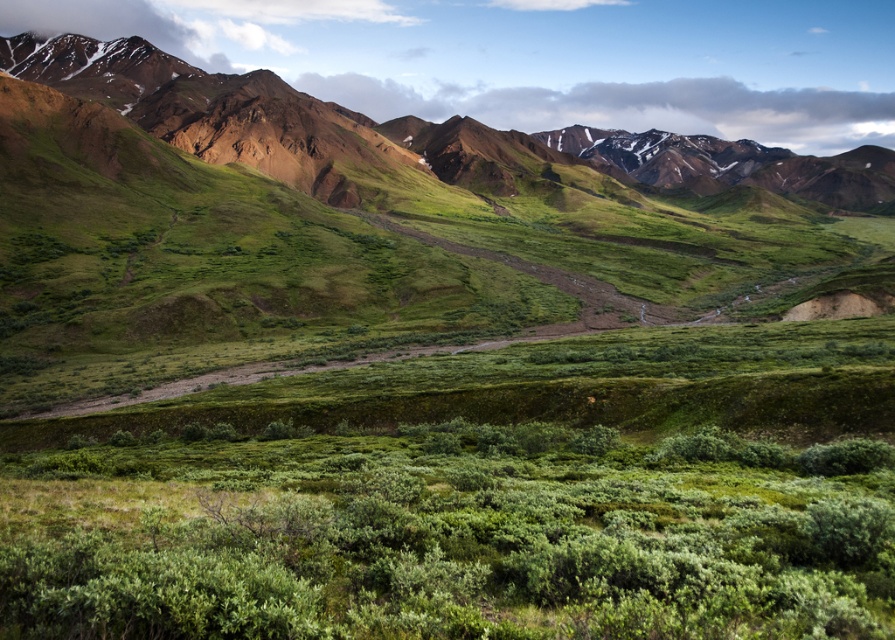
You are standing at the viewpoint and see two points marked in the landscape. The first point is at coordinates point [38,554] and the second is at point [442,180]. Which point is closer to you?

Point [38,554] is in front of point [442,180], so it is closer to you.

You are a hiker standing at the edge of the green leafy shrubs at center and looking towards the rustic brown mountains at upper left. Which object is closer to you?

The green leafy shrubs at center are closer to you than the rustic brown mountains at upper left.

You are a hiker planning to take a photo of the rustic brown mountains at upper left and the green leafy shrubs at center. Which object should you position closer to the left side of your camera frame to include both in the photo?

To include both the green leafy shrubs at center and the rustic brown mountains at upper left in your photo, you should position the green leafy shrubs at center closer to the left side of your camera frame since it is already to the left of the rustic brown mountains at upper left.